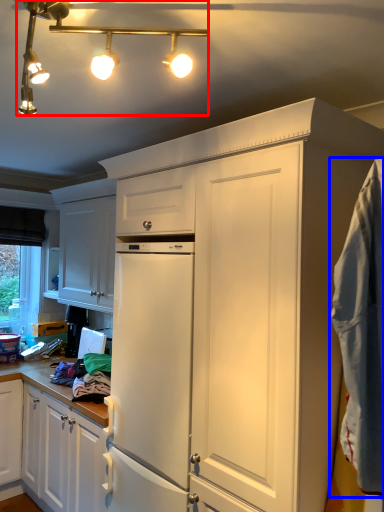
Question: Which object appears farthest to the camera in this image, light fixture (highlighted by a red box) or blanket (highlighted by a blue box)?

Choices:
 (A) light fixture
 (B) blanket

Answer: (B)